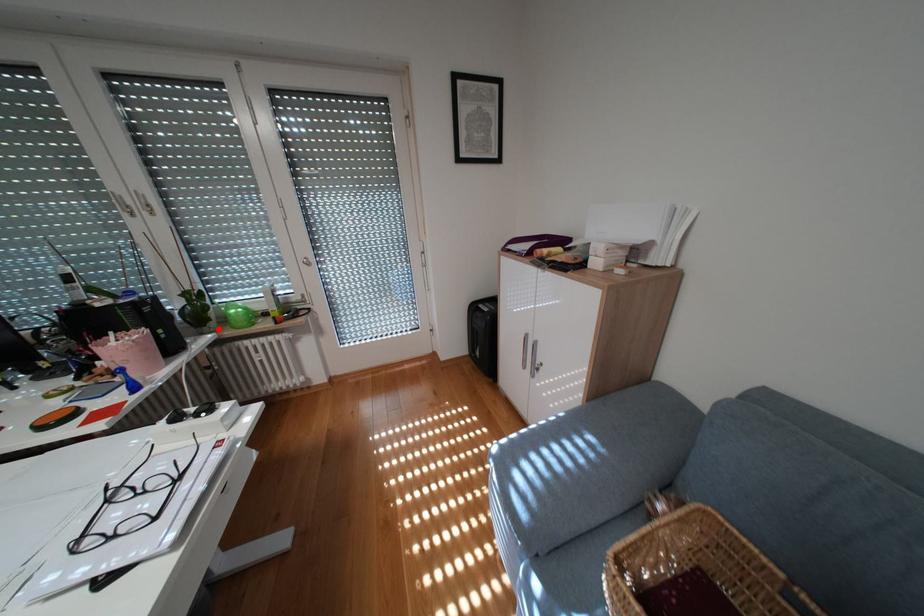
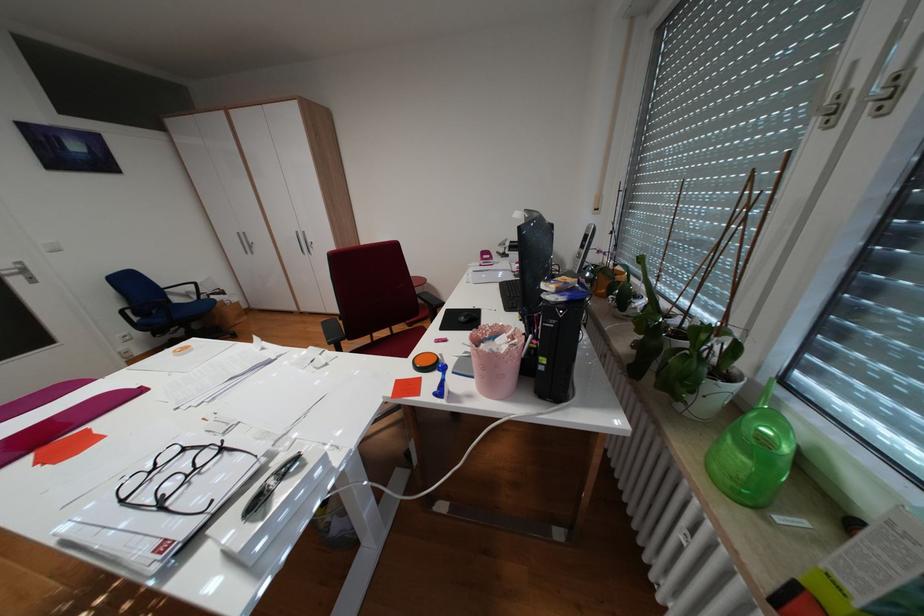
The point at the highlighted location is marked in the first image. Where is the corresponding point in the second image?

(691, 405)